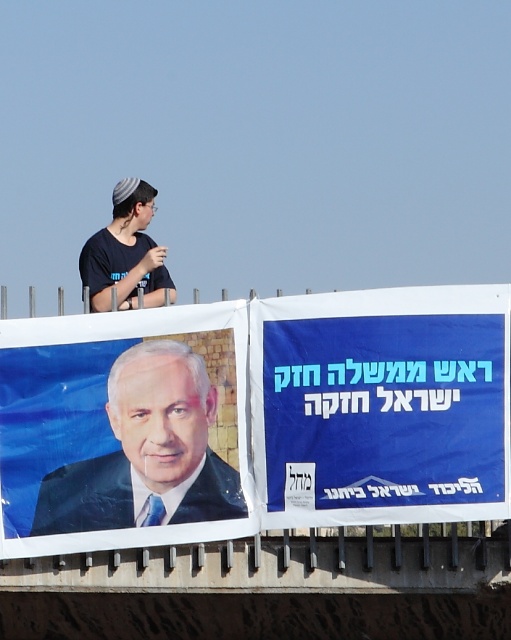
Question: Considering the relative positions of blue fabric banner at upper center and matte black t-shirt at upper left in the image provided, where is blue fabric banner at upper center located with respect to matte black t-shirt at upper left?

Choices:
 (A) above
 (B) below

Answer: (B)

Question: Can you confirm if blue fabric poster at upper center is thinner than dark blue suit at center?

Choices:
 (A) no
 (B) yes

Answer: (A)

Question: Among these points, which one is nearest to the camera?

Choices:
 (A) (426, 305)
 (B) (322, 419)
 (C) (137, 276)
 (D) (205, 372)

Answer: (A)

Question: Estimate the real-world distances between objects in this image. Which object is closer to the dark blue suit at center?

Choices:
 (A) blue fabric banner at upper center
 (B) blue fabric poster at upper center
 (C) matte black t-shirt at upper left

Answer: (B)

Question: Is blue fabric poster at upper center to the right of matte black t-shirt at upper left from the viewer's perspective?

Choices:
 (A) yes
 (B) no

Answer: (A)

Question: Which point is closer to the camera?

Choices:
 (A) dark blue suit at center
 (B) matte black t-shirt at upper left
 (C) blue fabric banner at upper center

Answer: (C)